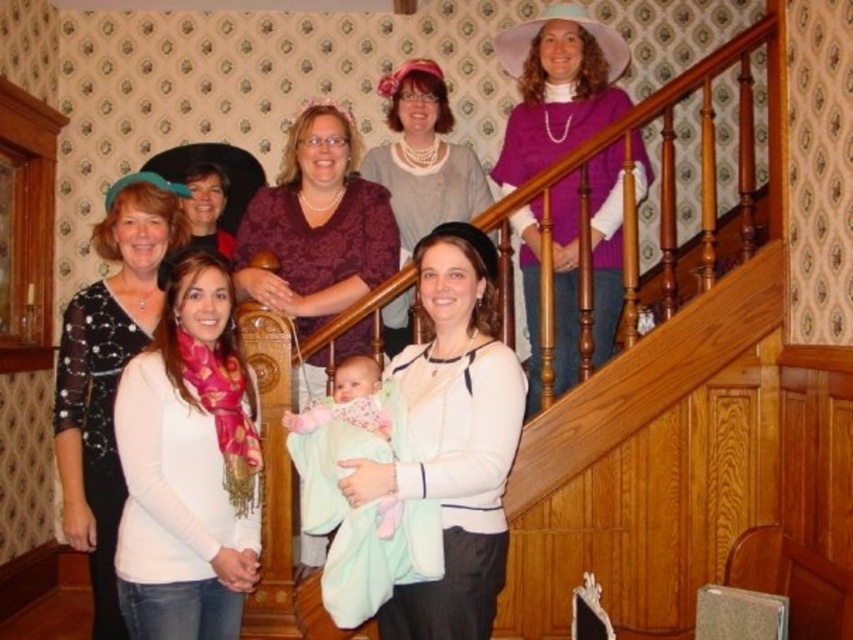
Question: Considering the real-world distances, which object is farthest from the purple matte sweater at upper right?

Choices:
 (A) matte gray sweater at center
 (B) pink scarf at lower left
 (C) matte black hat at upper center

Answer: (C)

Question: Can you confirm if purple matte sweater at upper right is wider than soft pastel blanket at center?

Choices:
 (A) no
 (B) yes

Answer: (B)

Question: Estimate the real-world distances between objects in this image. Which object is farther from the soft pastel blanket at center?

Choices:
 (A) purple matte sweater at upper right
 (B) pink scarf at lower left

Answer: (A)

Question: Which point is closer to the camera?

Choices:
 (A) matte gray sweater at center
 (B) matte black hat at upper center
 (C) white matte sweater at center

Answer: (C)

Question: Is sparkly black dress at left to the left of soft pastel blanket at center from the viewer's perspective?

Choices:
 (A) no
 (B) yes

Answer: (B)

Question: Is white matte sweater at center wider than purple matte sweater at upper right?

Choices:
 (A) yes
 (B) no

Answer: (B)